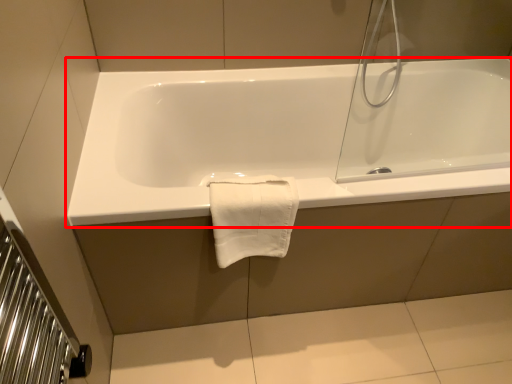
Question: In this image, where is bathtub (annotated by the red box) located relative to bath towel?

Choices:
 (A) left
 (B) right

Answer: (B)